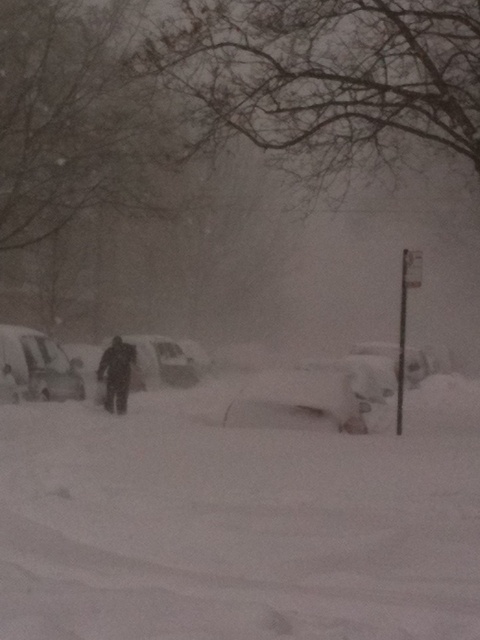
Can you confirm if white fluffy snow at center is taller than white matte car at center?

In fact, white fluffy snow at center may be shorter than white matte car at center.

Describe the element at coordinates (240, 516) in the screenshot. I see `white fluffy snow at center` at that location.

At what (x,y) coordinates should I click in order to perform the action: click on white fluffy snow at center. Please return your answer as a coordinate pair (x, y). The height and width of the screenshot is (640, 480). Looking at the image, I should click on click(x=240, y=516).

Image resolution: width=480 pixels, height=640 pixels. Identify the location of white fluffy snow at center. (240, 516).

From the picture: Does snow-covered sedan at left appear under white matte car at center?

No, snow-covered sedan at left is not below white matte car at center.

Is snow-covered sedan at left shorter than white matte car at center?

No.

Consider the image. Who is more distant from viewer, [16,333] or [145,362]?

Point [145,362]

Locate an element on the screen. This screenshot has height=640, width=480. snow-covered sedan at left is located at coordinates [x=35, y=368].

Consider the image. Can you confirm if snow-covered sedan at left is positioned to the left of dark gray fabric skier at center?

Yes, snow-covered sedan at left is to the left of dark gray fabric skier at center.

Is point (80, 396) positioned after point (122, 401)?

Yes, point (80, 396) is farther from viewer.

Identify the location of snow-covered sedan at left. Image resolution: width=480 pixels, height=640 pixels. (35, 368).